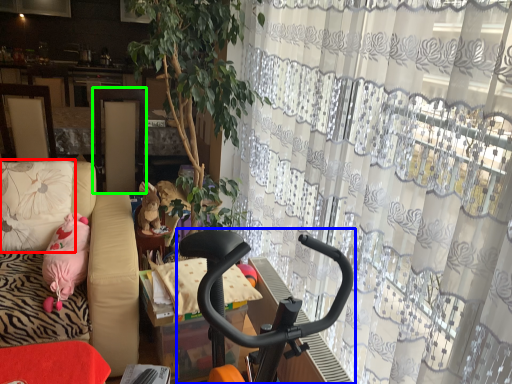
Question: Which object is the farthest from pillow (highlighted by a red box)? Choose among these: baby carriage (highlighted by a blue box) or screen door (highlighted by a green box).

Choices:
 (A) baby carriage
 (B) screen door

Answer: (A)